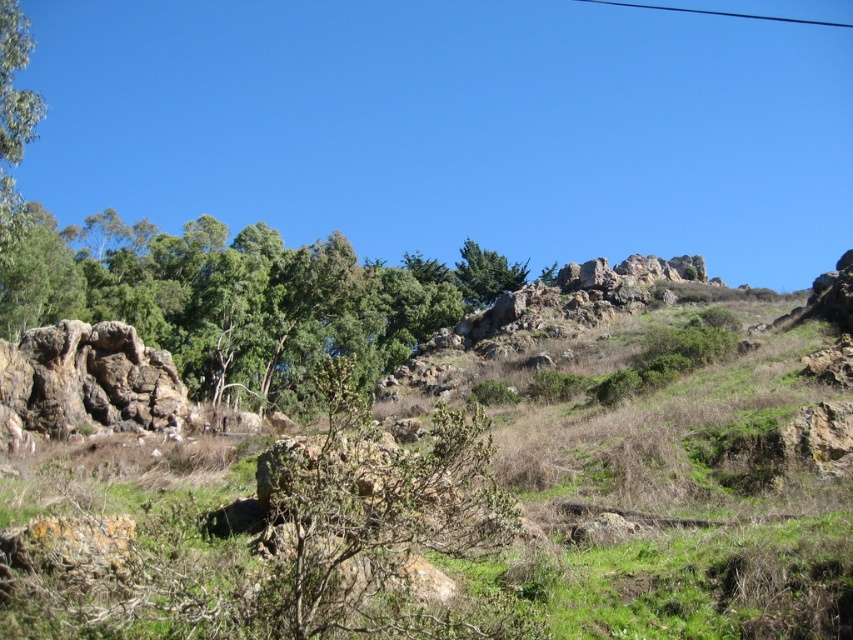
Can you confirm if green rough rock at upper center is bigger than green textured tree at upper center?

Yes, green rough rock at upper center is bigger than green textured tree at upper center.

Which is below, green rough rock at upper center or green textured tree at upper center?

green textured tree at upper center

Between point (222, 385) and point (477, 284), which one is positioned behind?

Point (477, 284)

This screenshot has width=853, height=640. In order to click on green rough rock at upper center in this screenshot , I will do `click(241, 298)`.

Who is positioned more to the left, green leafy tree at upper left or green textured tree at upper center?

Positioned to the left is green leafy tree at upper left.

Is green leafy tree at upper left wider than green textured tree at upper center?

No.

Locate an element on the screen. green leafy tree at upper left is located at coordinates (13, 120).

Based on the photo, which of these two, green rough rock at upper center or green leafy tree at upper left, stands shorter?

Standing shorter between the two is green leafy tree at upper left.

Can you confirm if green rough rock at upper center is positioned to the left of green leafy tree at upper left?

In fact, green rough rock at upper center is to the right of green leafy tree at upper left.

The width and height of the screenshot is (853, 640). What do you see at coordinates (241, 298) in the screenshot? I see `green rough rock at upper center` at bounding box center [241, 298].

Locate an element on the screen. This screenshot has height=640, width=853. green rough rock at upper center is located at coordinates (241, 298).